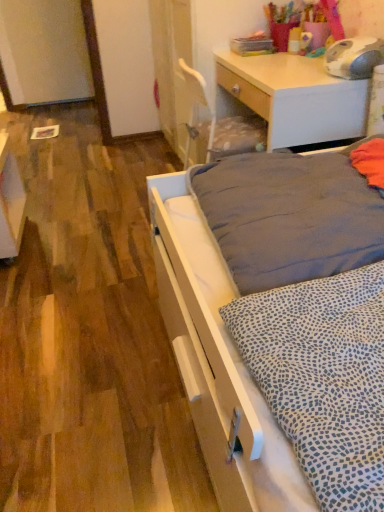
Question: From a real-world perspective, is white glossy vanity at lower left on top of dark gray fabric mattress at center?

Choices:
 (A) yes
 (B) no

Answer: (B)

Question: Considering the relative sizes of white glossy vanity at lower left and dark gray fabric mattress at center in the image provided, is white glossy vanity at lower left shorter than dark gray fabric mattress at center?

Choices:
 (A) no
 (B) yes

Answer: (A)

Question: Is white glossy vanity at lower left facing away from dark gray fabric mattress at center?

Choices:
 (A) yes
 (B) no

Answer: (B)

Question: Does white glossy vanity at lower left have a larger size compared to dark gray fabric mattress at center?

Choices:
 (A) yes
 (B) no

Answer: (B)

Question: Is white glossy vanity at lower left next to dark gray fabric mattress at center and touching it?

Choices:
 (A) no
 (B) yes

Answer: (A)

Question: From the image's perspective, is white matte bed at lower right above or below dark gray fabric mattress at center?

Choices:
 (A) below
 (B) above

Answer: (A)

Question: Is white matte bed at lower right wider or thinner than dark gray fabric mattress at center?

Choices:
 (A) wide
 (B) thin

Answer: (A)

Question: Would you say white matte bed at lower right is to the left or to the right of dark gray fabric mattress at center in the picture?

Choices:
 (A) left
 (B) right

Answer: (A)

Question: Relative to dark gray fabric mattress at center, is white matte bed at lower right in front or behind?

Choices:
 (A) front
 (B) behind

Answer: (B)

Question: Does point (261, 92) appear closer or farther from the camera than point (19, 182)?

Choices:
 (A) closer
 (B) farther

Answer: (A)

Question: Looking at their shapes, would you say light wood desk at upper right is wider or thinner than white glossy vanity at lower left?

Choices:
 (A) thin
 (B) wide

Answer: (B)

Question: Based on their sizes in the image, would you say light wood desk at upper right is bigger or smaller than white glossy vanity at lower left?

Choices:
 (A) small
 (B) big

Answer: (B)

Question: Considering the positions of light wood desk at upper right and white glossy vanity at lower left in the image, is light wood desk at upper right taller or shorter than white glossy vanity at lower left?

Choices:
 (A) tall
 (B) short

Answer: (A)

Question: From the image's perspective, is white glossy vanity at lower left positioned above or below light wood desk at upper right?

Choices:
 (A) below
 (B) above

Answer: (A)

Question: Considering the positions of white glossy vanity at lower left and light wood desk at upper right in the image, is white glossy vanity at lower left taller or shorter than light wood desk at upper right?

Choices:
 (A) tall
 (B) short

Answer: (B)